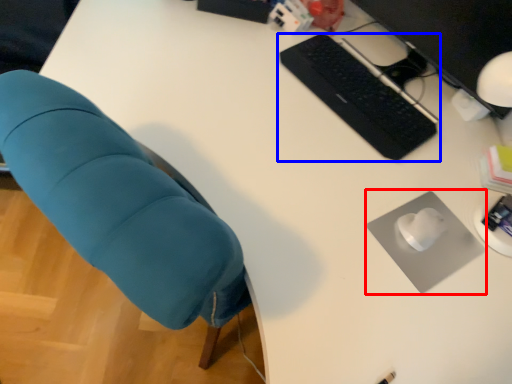
Question: Which of the following is the closest to the observer, mousepad (highlighted by a red box) or computer keyboard (highlighted by a blue box)?

Choices:
 (A) mousepad
 (B) computer keyboard

Answer: (A)